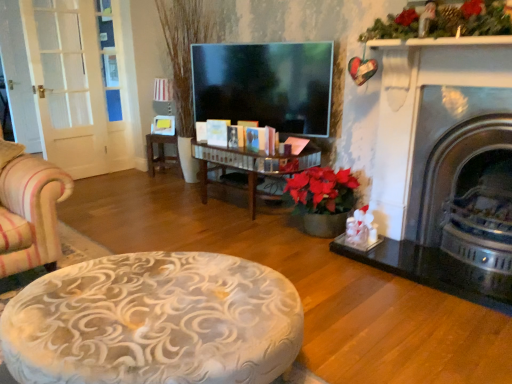
Measure the distance between shiny silver fireplace at right and camera.

The distance of shiny silver fireplace at right from camera is 2.01 meters.

In order to face shiny silver fireplace at right, should I rotate leftwards or rightwards?

A 27.304 degree turn to the right will do.

What do you see at coordinates (465, 188) in the screenshot? This screenshot has height=384, width=512. I see `shiny silver fireplace at right` at bounding box center [465, 188].

Identify the location of shiny silver fireplace at right. The width and height of the screenshot is (512, 384). (465, 188).

What do you see at coordinates (161, 154) in the screenshot? I see `wooden table at center` at bounding box center [161, 154].

Identify the location of wooden table at center. The width and height of the screenshot is (512, 384). (161, 154).

In order to face wooden table at center, should I rotate leftwards or rightwards?

You should look left and rotate roughly 11.638 degrees.

Image resolution: width=512 pixels, height=384 pixels. I want to click on shiny silver fireplace at right, so click(x=465, y=188).

Does shiny silver fireplace at right appear on the right side of wooden table at center?

Yes, shiny silver fireplace at right is to the right of wooden table at center.

Does shiny silver fireplace at right come behind wooden table at center?

No, it is in front of wooden table at center.

Which is nearer, (503,275) or (161,167)?

The point (503,275) is in front.

From the image's perspective, which is below, shiny silver fireplace at right or wooden table at center?

shiny silver fireplace at right is shown below in the image.

From a real-world perspective, who is located higher, shiny silver fireplace at right or wooden table at center?

shiny silver fireplace at right is physically above.

Considering the sizes of objects shiny silver fireplace at right and wooden table at center in the image provided, who is wider, shiny silver fireplace at right or wooden table at center?

shiny silver fireplace at right is wider.

In terms of height, does shiny silver fireplace at right look taller or shorter compared to wooden table at center?

Considering their sizes, shiny silver fireplace at right has more height than wooden table at center.

Considering the sizes of shiny silver fireplace at right and wooden table at center in the image, is shiny silver fireplace at right bigger or smaller than wooden table at center?

shiny silver fireplace at right is bigger than wooden table at center.

Does shiny silver fireplace at right contain wooden table at center?

No, wooden table at center is not surrounded by shiny silver fireplace at right.

Can you see shiny silver fireplace at right touching wooden table at center?

No, shiny silver fireplace at right is not making contact with wooden table at center.

Is shiny silver fireplace at right facing away from wooden table at center?

shiny silver fireplace at right does not have its back to wooden table at center.

How different are the orientations of shiny silver fireplace at right and wooden table at center in degrees?

There is a 33.6-degree angle between the facing directions of shiny silver fireplace at right and wooden table at center.

Measure the distance between shiny silver fireplace at right and wooden table at center.

shiny silver fireplace at right and wooden table at center are 2.69 meters apart.

In the image, there is a wooden table at center. In order to click on fireplace below it (from the image's perspective) in this screenshot , I will do `click(465, 188)`.

Between wooden table at center and shiny silver fireplace at right, which one appears on the left side from the viewer's perspective?

wooden table at center.

Which object is closer to the camera, wooden table at center or shiny silver fireplace at right?

shiny silver fireplace at right is more forward.

Which point is more distant from viewer, (170, 160) or (508, 133)?

The point (170, 160) is behind.

From the image's perspective, would you say wooden table at center is shown under shiny silver fireplace at right?

No, from the image's perspective, wooden table at center is not beneath shiny silver fireplace at right.

From a real-world perspective, is wooden table at center positioned above or below shiny silver fireplace at right?

wooden table at center is below shiny silver fireplace at right.

Is wooden table at center thinner than shiny silver fireplace at right?

Yes, wooden table at center is thinner than shiny silver fireplace at right.

Considering the sizes of objects wooden table at center and shiny silver fireplace at right in the image provided, who is taller, wooden table at center or shiny silver fireplace at right?

Standing taller between the two is shiny silver fireplace at right.

Which of these two, wooden table at center or shiny silver fireplace at right, is bigger?

shiny silver fireplace at right is bigger.

Is wooden table at center positioned beyond the bounds of shiny silver fireplace at right?

Indeed, wooden table at center is completely outside shiny silver fireplace at right.

Are wooden table at center and shiny silver fireplace at right far apart?

wooden table at center is far away from shiny silver fireplace at right.

Looking at this image, is wooden table at center positioned with its back to shiny silver fireplace at right?

wooden table at center is not turned away from shiny silver fireplace at right.

How different are the orientations of wooden table at center and shiny silver fireplace at right in degrees?

The angular difference between wooden table at center and shiny silver fireplace at right is 33.6 degrees.

You are a GUI agent. You are given a task and a screenshot of the screen. Output one action in this format:
    pyautogui.click(x=<x>, y=<y>)
    Task: Click on the table that appears above the shiny silver fireplace at right (from the image's perspective)
    
    Given the screenshot: What is the action you would take?
    pyautogui.click(x=161, y=154)

This screenshot has width=512, height=384. In order to click on table on the left of shiny silver fireplace at right in this screenshot , I will do `click(161, 154)`.

This screenshot has height=384, width=512. Identify the location of table behind the shiny silver fireplace at right. (161, 154).